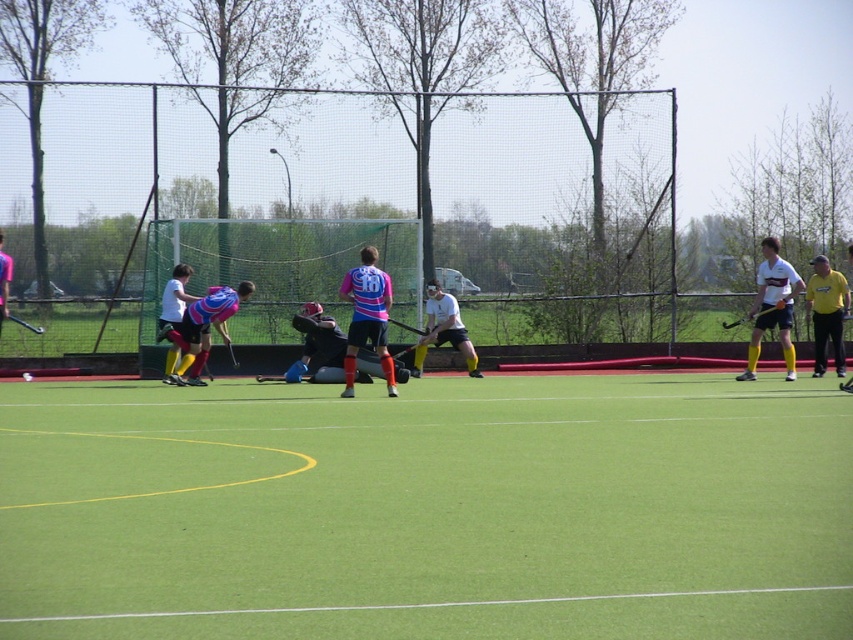
You are a field hockey player standing at the edge of the field. You need to retrieve a ball that rolled between the green artificial turf at center and the matte black helmet at center. If your maximum reach without moving is 2 meters, can you reach the ball?

The distance between the green artificial turf at center and the matte black helmet at center is 5.62 meters. Since your maximum reach is only 2 meters, you cannot reach the ball without moving closer.

In the scene shown: You are a sports analyst watching the field hockey match. You need to report the exact position of the matte pink jersey at center on the field. What are its coordinates?

The matte pink jersey at center is located at coordinates point [202,330].